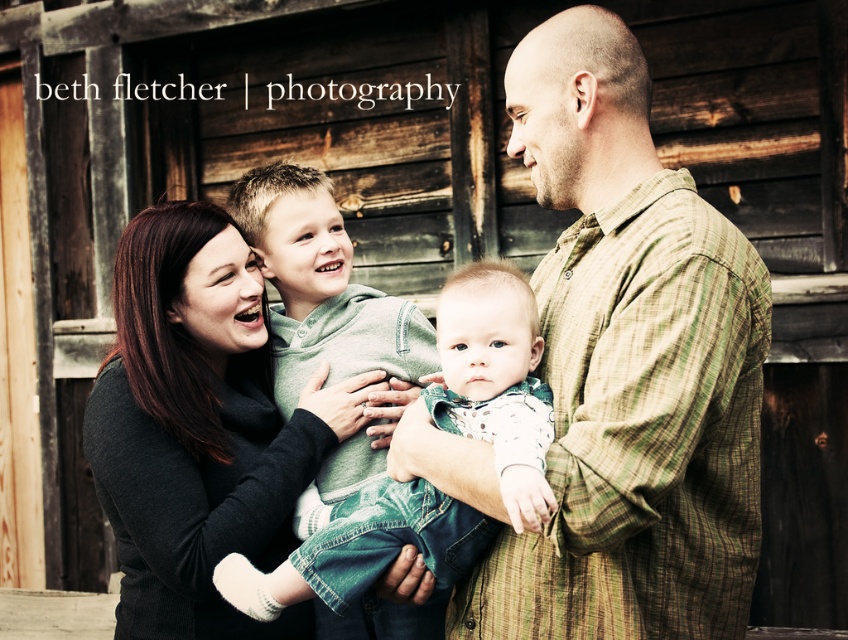
Can you confirm if green plaid shirt at center is positioned to the left of soft white knit sweater at center?

In fact, green plaid shirt at center is to the right of soft white knit sweater at center.

Can you confirm if green plaid shirt at center is shorter than soft white knit sweater at center?

No.

You are a GUI agent. You are given a task and a screenshot of the screen. Output one action in this format:
    pyautogui.click(x=<x>, y=<y>)
    Task: Click on the green plaid shirt at center
    The width and height of the screenshot is (848, 640).
    Given the screenshot: What is the action you would take?
    pyautogui.click(x=628, y=368)

Which is more to the left, matte black sweater at center or soft white knit sweater at center?

From the viewer's perspective, matte black sweater at center appears more on the left side.

This screenshot has width=848, height=640. What do you see at coordinates (199, 428) in the screenshot? I see `matte black sweater at center` at bounding box center [199, 428].

Does point (182, 440) come closer to viewer compared to point (483, 344)?

No, it is not.

Locate an element on the screen. matte black sweater at center is located at coordinates (199, 428).

What do you see at coordinates (628, 368) in the screenshot? I see `green plaid shirt at center` at bounding box center [628, 368].

Measure the distance between green plaid shirt at center and camera.

They are 5.27 feet apart.

Find the location of a particular element. green plaid shirt at center is located at coordinates (628, 368).